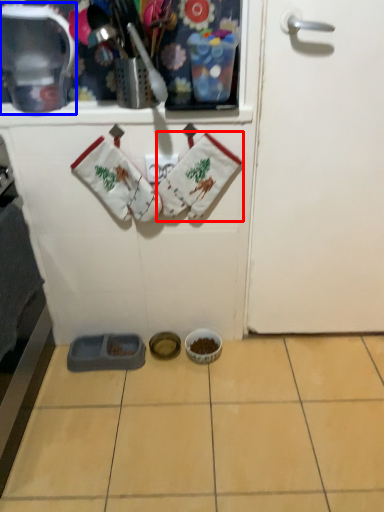
Question: Which point is further to the camera, baby clothe (highlighted by a red box) or appliance (highlighted by a blue box)?

Choices:
 (A) baby clothe
 (B) appliance

Answer: (A)